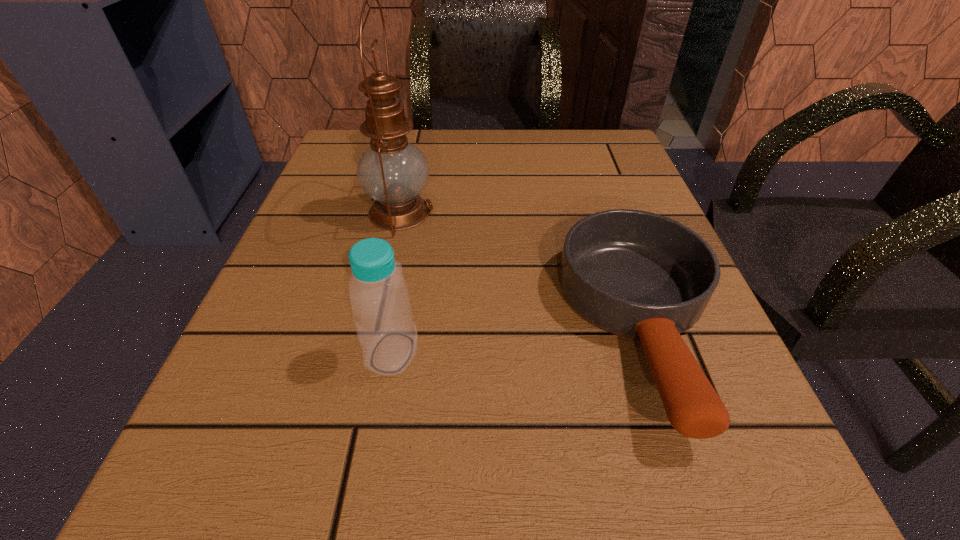
Identify the location of object that is at the near right corner. (636, 274).

This screenshot has width=960, height=540. Find the location of `vacant space at the far edge of the desktop`. vacant space at the far edge of the desktop is located at coordinates (485, 152).

Locate an element on the screen. free space at the near edge is located at coordinates (358, 532).

This screenshot has width=960, height=540. In order to click on vacant space at the left edge in this screenshot , I will do `click(334, 254)`.

At what (x,y) coordinates should I click in order to perform the action: click on vacant space at the right edge. Please return your answer as a coordinate pair (x, y). The image size is (960, 540). Looking at the image, I should click on (650, 433).

The height and width of the screenshot is (540, 960). Find the location of `vacant space at the far right corner of the desktop`. vacant space at the far right corner of the desktop is located at coordinates (618, 168).

Where is `empty space between the oil lamp and the rightmost object`? The height and width of the screenshot is (540, 960). empty space between the oil lamp and the rightmost object is located at coordinates (521, 270).

Image resolution: width=960 pixels, height=540 pixels. Identify the location of unoccupied area between the shortest object and the bottle. (517, 340).

This screenshot has height=540, width=960. Identify the location of empty space between the farthest object and the pan. (521, 270).

You are a GUI agent. You are given a task and a screenshot of the screen. Output one action in this format:
    pyautogui.click(x=<x>, y=<y>)
    Task: Click on the free spot between the oil lamp and the rightmost object
    The image size is (960, 540).
    Given the screenshot: What is the action you would take?
    pyautogui.click(x=521, y=270)